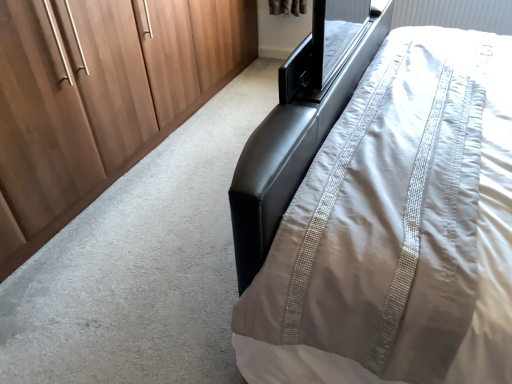
Question: Is matte wood wardrobe at left situated inside satin white bed at right or outside?

Choices:
 (A) outside
 (B) inside

Answer: (A)

Question: Does point (28, 39) appear closer or farther from the camera than point (455, 243)?

Choices:
 (A) closer
 (B) farther

Answer: (B)

Question: Considering the positions of matte wood wardrobe at left and satin white bed at right in the image, is matte wood wardrobe at left taller or shorter than satin white bed at right?

Choices:
 (A) tall
 (B) short

Answer: (A)

Question: Would you say satin white bed at right is inside or outside matte wood wardrobe at left?

Choices:
 (A) outside
 (B) inside

Answer: (A)

Question: From a real-world perspective, is satin white bed at right positioned above or below matte wood wardrobe at left?

Choices:
 (A) above
 (B) below

Answer: (A)

Question: Visually, is satin white bed at right positioned to the left or to the right of matte wood wardrobe at left?

Choices:
 (A) right
 (B) left

Answer: (A)

Question: From the image's perspective, relative to matte wood wardrobe at left, is satin white bed at right above or below?

Choices:
 (A) above
 (B) below

Answer: (B)